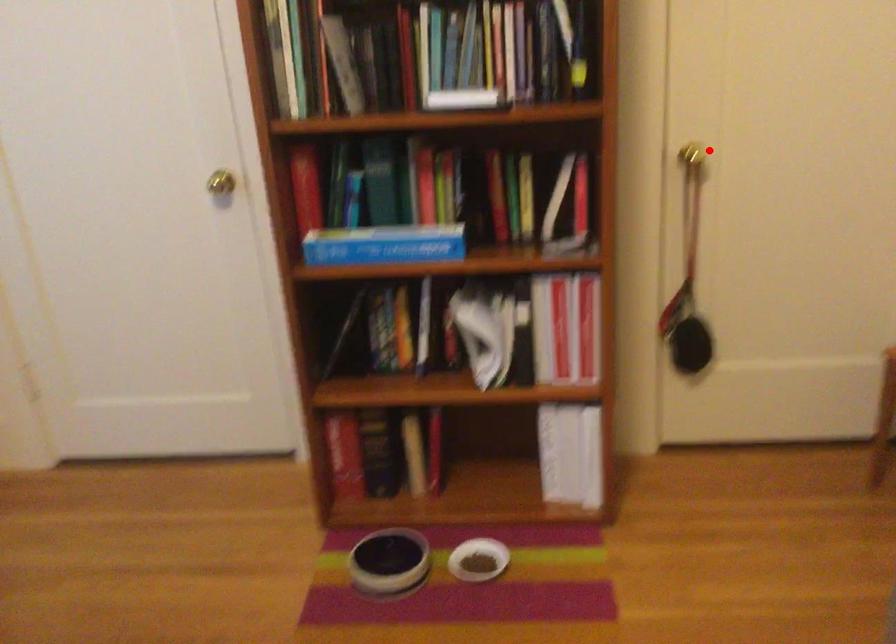
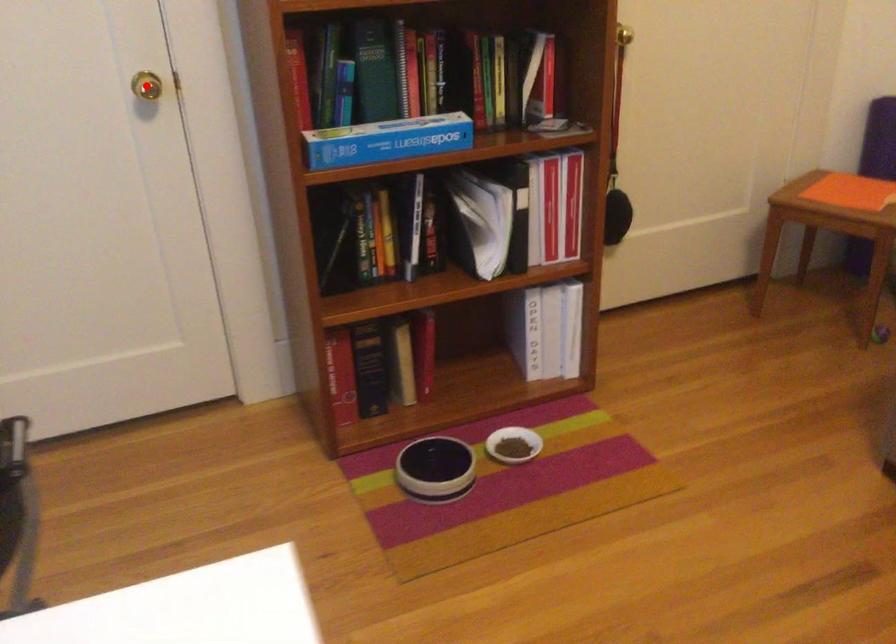
I am providing you with two images of the same scene from different viewpoints. A red point is marked on the first image and another point is marked on the second image. Does the point marked in image1 correspond to the same location as the one in image2?

No